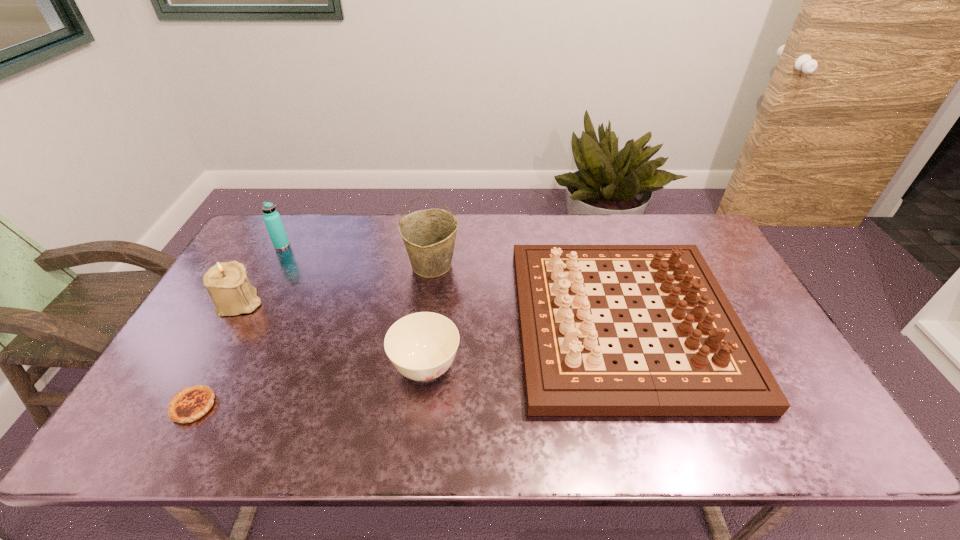
At what (x,y) coordinates should I click in order to perform the action: click on water bottle that is at the left edge. Please return your answer as a coordinate pair (x, y). Looking at the image, I should click on (273, 222).

Identify the location of candle_holder that is at the left edge. The height and width of the screenshot is (540, 960). (227, 283).

At what (x,y) coordinates should I click in order to perform the action: click on quiche at the left edge. Please return your answer as a coordinate pair (x, y). The image size is (960, 540). Looking at the image, I should click on (189, 404).

Find the location of a particular element. This screenshot has height=540, width=960. object that is positioned at the right edge is located at coordinates (568, 367).

Where is `object that is at the far left corner`? This screenshot has width=960, height=540. object that is at the far left corner is located at coordinates (273, 222).

Image resolution: width=960 pixels, height=540 pixels. Find the location of `object that is at the near left corner`. object that is at the near left corner is located at coordinates (189, 404).

The image size is (960, 540). Find the location of `object that is positioned at the far right corner`. object that is positioned at the far right corner is located at coordinates (568, 367).

Locate an element on the screen. The image size is (960, 540). object that is at the near right corner is located at coordinates (568, 367).

Where is `free space at the far edge of the desktop`? Image resolution: width=960 pixels, height=540 pixels. free space at the far edge of the desktop is located at coordinates (596, 223).

Image resolution: width=960 pixels, height=540 pixels. In the image, there is a desktop. In order to click on vacant space at the near edge in this screenshot , I will do `click(596, 422)`.